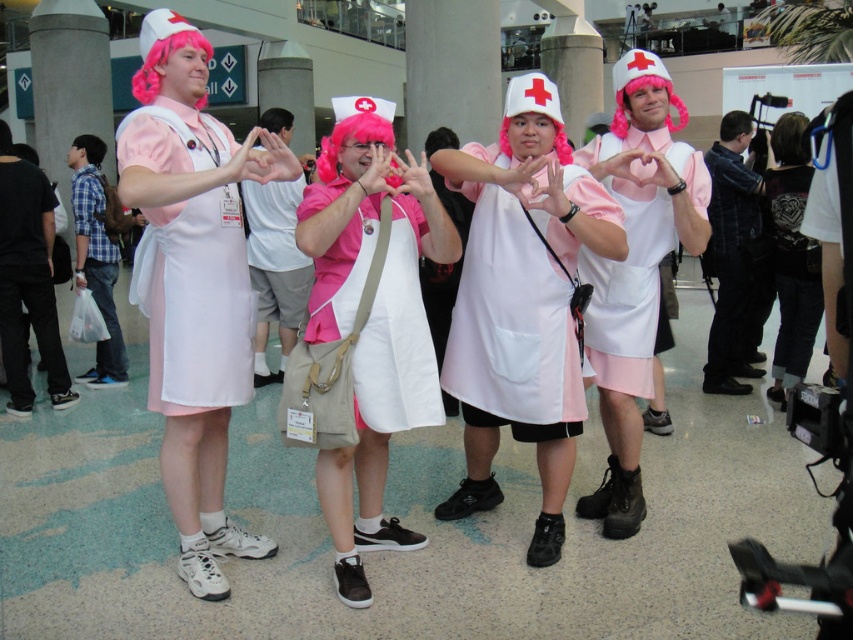
From the picture: Between pink matte dress at center and matte white apron at center, which one has more height?

With more height is pink matte dress at center.

Can you confirm if pink matte dress at center is bigger than matte white apron at center?

Yes.

Describe the element at coordinates (193, 282) in the screenshot. Image resolution: width=853 pixels, height=640 pixels. I see `pink matte dress at center` at that location.

This screenshot has width=853, height=640. What are the coordinates of `pink matte dress at center` in the screenshot? It's located at (193, 282).

Between point (534, 236) and point (233, 225), which one is positioned in front?

Point (233, 225)

In order to click on matte pink apron at center in this screenshot , I will do `click(511, 320)`.

Consider the image. Between pink matte dress at center and matte pink apron at center, which one appears on the left side from the viewer's perspective?

From the viewer's perspective, pink matte dress at center appears more on the left side.

Is pink matte dress at center in front of matte pink apron at center?

Yes, pink matte dress at center is in front of matte pink apron at center.

Is point (177, 372) less distant than point (599, 208)?

Yes, it is.

Image resolution: width=853 pixels, height=640 pixels. I want to click on pink matte dress at center, so click(x=193, y=282).